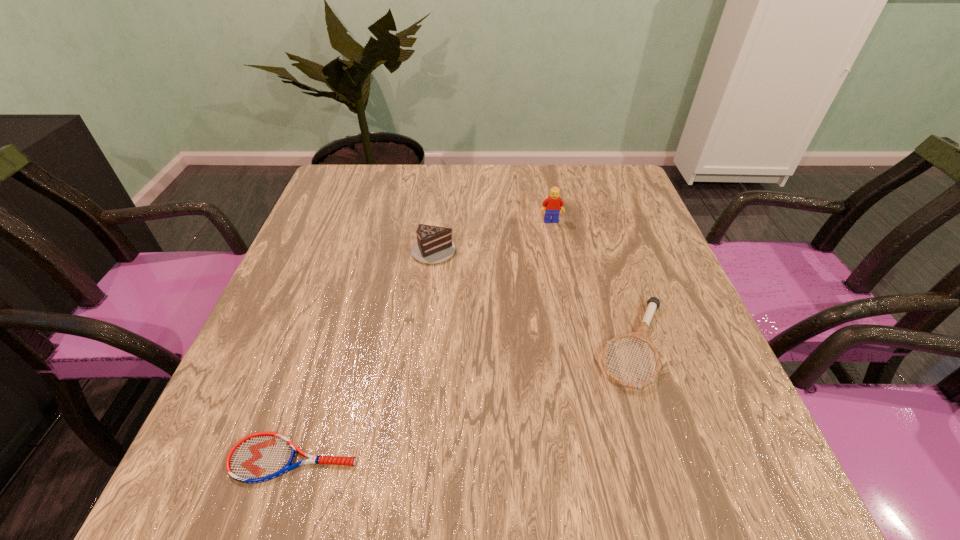
Where is `Lego`? The image size is (960, 540). Lego is located at coordinates (553, 203).

You are a GUI agent. You are given a task and a screenshot of the screen. Output one action in this format:
    pyautogui.click(x=<x>, y=<y>)
    Task: Click on the tallest object
    This screenshot has height=540, width=960.
    Given the screenshot: What is the action you would take?
    pyautogui.click(x=553, y=203)

Find the location of a particular element. The width and height of the screenshot is (960, 540). the third shortest object is located at coordinates (434, 244).

In order to click on the second object from left to right in this screenshot , I will do `click(434, 244)`.

You are a GUI agent. You are given a task and a screenshot of the screen. Output one action in this format:
    pyautogui.click(x=<x>, y=<y>)
    Task: Click on the farther tennis racket
    The width and height of the screenshot is (960, 540).
    Given the screenshot: What is the action you would take?
    pyautogui.click(x=641, y=334)

Find the location of a particular element. The height and width of the screenshot is (540, 960). the right tennis racket is located at coordinates (641, 334).

Find the location of `the leftmost object`. the leftmost object is located at coordinates (259, 457).

Identify the location of the shortest object. The image size is (960, 540). (259, 457).

This screenshot has height=540, width=960. Find the location of `vacant region located 0.310m on the face of the tallest object`. vacant region located 0.310m on the face of the tallest object is located at coordinates (569, 313).

This screenshot has width=960, height=540. In order to click on vacant space situated 0.170m on the back of the third object from right to left in this screenshot , I will do `click(440, 197)`.